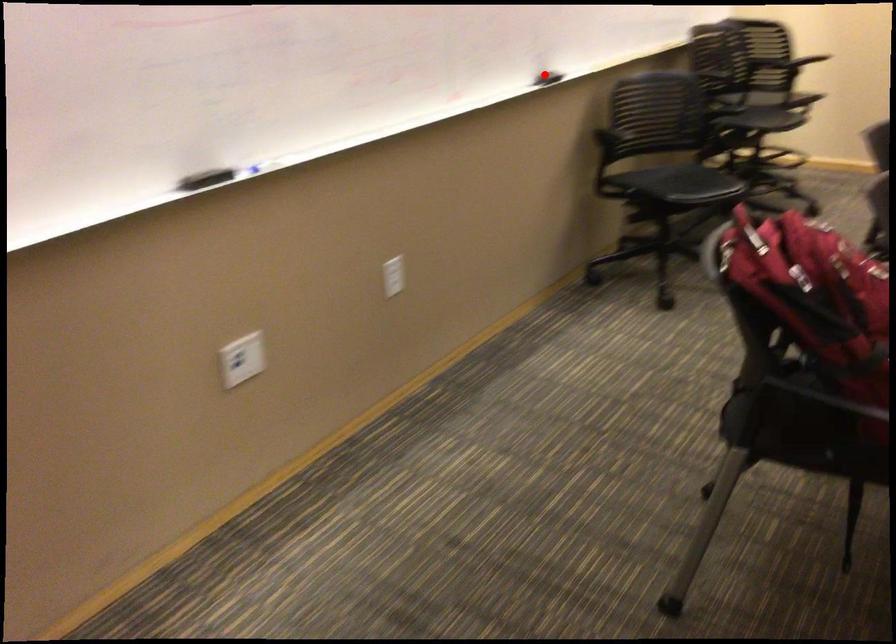
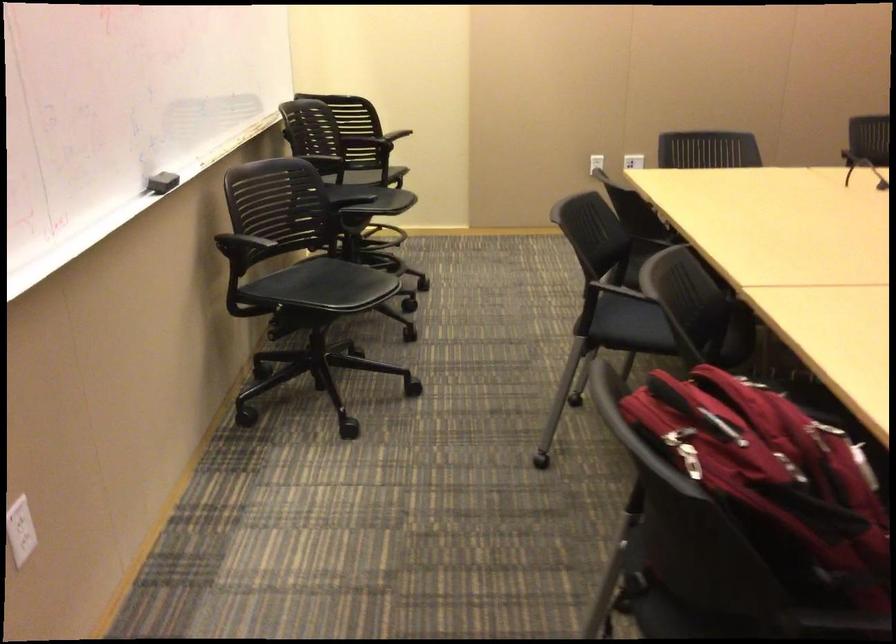
Question: I am providing you with two images of the same scene from different viewpoints. In image1, a red point is highlighted. Considering the same 3D point in image2, which of the following is correct?

Choices:
 (A) It is closer
 (B) It is farther

Answer: (A)